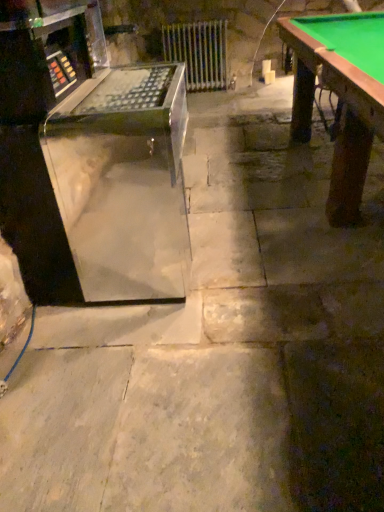
What do you see at coordinates (198, 52) in the screenshot? The width and height of the screenshot is (384, 512). I see `metallic silver radiator at center` at bounding box center [198, 52].

Image resolution: width=384 pixels, height=512 pixels. I want to click on metallic silver radiator at center, so click(x=198, y=52).

Measure the distance between transparent acrylic machine at left and camera.

The depth of transparent acrylic machine at left is 1.39 meters.

What do you see at coordinates (91, 166) in the screenshot? This screenshot has width=384, height=512. I see `transparent acrylic machine at left` at bounding box center [91, 166].

You are a GUI agent. You are given a task and a screenshot of the screen. Output one action in this format:
    pyautogui.click(x=<x>, y=<y>)
    Task: Click on the transparent acrylic machine at left
    This screenshot has width=384, height=512.
    Given the screenshot: What is the action you would take?
    pyautogui.click(x=91, y=166)

The image size is (384, 512). Find the location of `metallic silver radiator at center`. metallic silver radiator at center is located at coordinates (198, 52).

Considering the positions of objects transparent acrylic machine at left and metallic silver radiator at center in the image provided, who is more to the left, transparent acrylic machine at left or metallic silver radiator at center?

Positioned to the left is transparent acrylic machine at left.

Which is in front, transparent acrylic machine at left or metallic silver radiator at center?

transparent acrylic machine at left.

Is point (20, 100) closer or farther from the camera than point (213, 50)?

Point (20, 100).

From the image's perspective, who appears lower, transparent acrylic machine at left or metallic silver radiator at center?

transparent acrylic machine at left is shown below in the image.

From a real-world perspective, which object stands above the other?

transparent acrylic machine at left.

Which of these two, transparent acrylic machine at left or metallic silver radiator at center, is wider?

Wider between the two is transparent acrylic machine at left.

Which of these two, transparent acrylic machine at left or metallic silver radiator at center, stands shorter?

With less height is metallic silver radiator at center.

Is transparent acrylic machine at left smaller than metallic silver radiator at center?

Actually, transparent acrylic machine at left might be larger than metallic silver radiator at center.

Is transparent acrylic machine at left positioned beyond the bounds of metallic silver radiator at center?

transparent acrylic machine at left is positioned outside metallic silver radiator at center.

Is transparent acrylic machine at left with metallic silver radiator at center?

They are not placed beside each other.

Is transparent acrylic machine at left oriented away from metallic silver radiator at center?

No, transparent acrylic machine at left is not facing away from metallic silver radiator at center.

Can you tell me how much transparent acrylic machine at left and metallic silver radiator at center differ in facing direction?

86.5 degrees separate the facing orientations of transparent acrylic machine at left and metallic silver radiator at center.

Find the location of `equipment to the left of metallic silver radiator at center`. equipment to the left of metallic silver radiator at center is located at coordinates (91, 166).

Considering the positions of objects metallic silver radiator at center and transparent acrylic machine at left in the image provided, who is more to the left, metallic silver radiator at center or transparent acrylic machine at left?

transparent acrylic machine at left.

From the picture: Which is behind, metallic silver radiator at center or transparent acrylic machine at left?

metallic silver radiator at center is behind.

Does point (215, 73) appear closer or farther from the camera than point (8, 146)?

Clearly, point (215, 73) is more distant from the camera than point (8, 146).

From the image's perspective, which one is positioned lower, metallic silver radiator at center or transparent acrylic machine at left?

transparent acrylic machine at left appears lower in the image.

From a real-world perspective, between metallic silver radiator at center and transparent acrylic machine at left, who is vertically lower?

metallic silver radiator at center is physically lower.

Can you confirm if metallic silver radiator at center is thinner than transparent acrylic machine at left?

Yes, metallic silver radiator at center is thinner than transparent acrylic machine at left.

From their relative heights in the image, would you say metallic silver radiator at center is taller or shorter than transparent acrylic machine at left?

Clearly, metallic silver radiator at center is shorter compared to transparent acrylic machine at left.

Can you confirm if metallic silver radiator at center is smaller than transparent acrylic machine at left?

Correct, metallic silver radiator at center occupies less space than transparent acrylic machine at left.

Is metallic silver radiator at center outside of transparent acrylic machine at left?

Yes, metallic silver radiator at center is not within transparent acrylic machine at left.

Is metallic silver radiator at center far from transparent acrylic machine at left?

Yes, metallic silver radiator at center and transparent acrylic machine at left are quite far apart.

Is metallic silver radiator at center oriented towards transparent acrylic machine at left?

Yes, metallic silver radiator at center is aimed at transparent acrylic machine at left.

Locate an element on the screen. equipment that is on the left side of metallic silver radiator at center is located at coordinates (91, 166).

The width and height of the screenshot is (384, 512). Find the location of `radiator behind the transparent acrylic machine at left`. radiator behind the transparent acrylic machine at left is located at coordinates (198, 52).

Find the location of `radiator on the right of transparent acrylic machine at left`. radiator on the right of transparent acrylic machine at left is located at coordinates (198, 52).